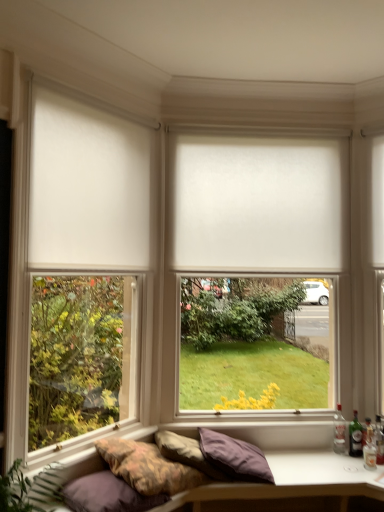
The width and height of the screenshot is (384, 512). Identify the location of vacant space situated above white matte window blind at center (from a real-world perspective). (248, 132).